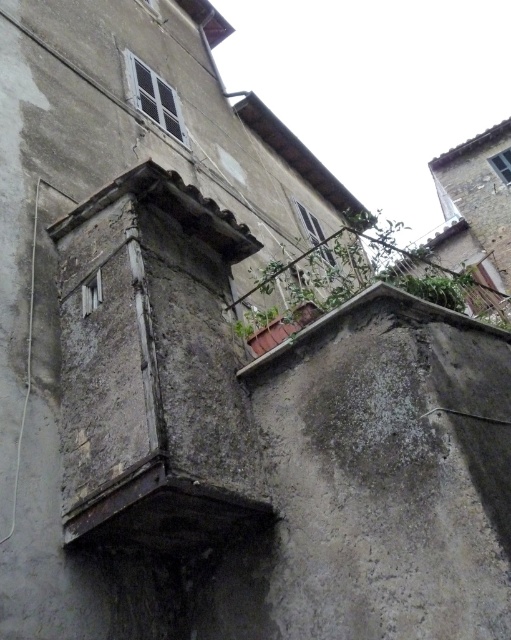
Between rustic concrete ledge at center and green leafy plant at upper right, which one appears on the left side from the viewer's perspective?

rustic concrete ledge at center

The image size is (511, 640). In order to click on rustic concrete ledge at center in this screenshot , I will do `click(360, 307)`.